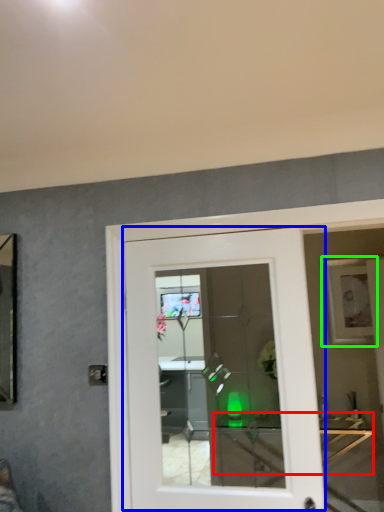
Question: Based on their relative distances, which object is nearer to table (highlighted by a red box)? Choose from door (highlighted by a blue box) and picture frame (highlighted by a green box).

Choices:
 (A) door
 (B) picture frame

Answer: (B)